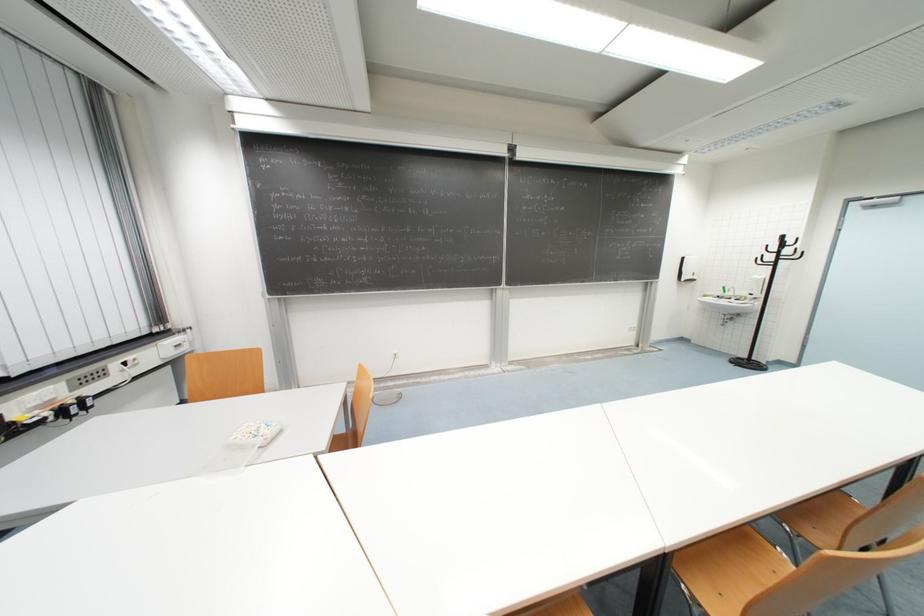
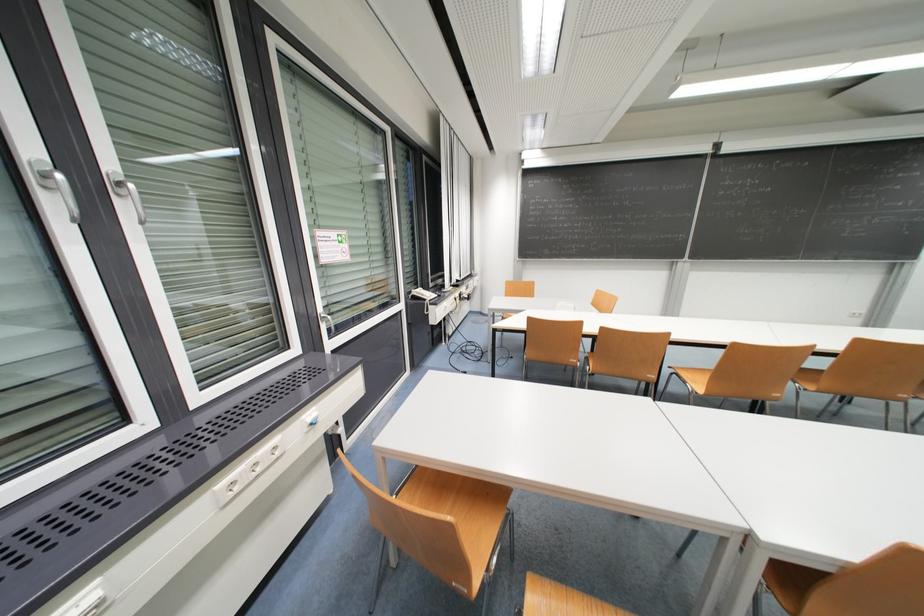
Where in the second image is the point corresponding to (x=639, y=326) from the first image?

(869, 313)